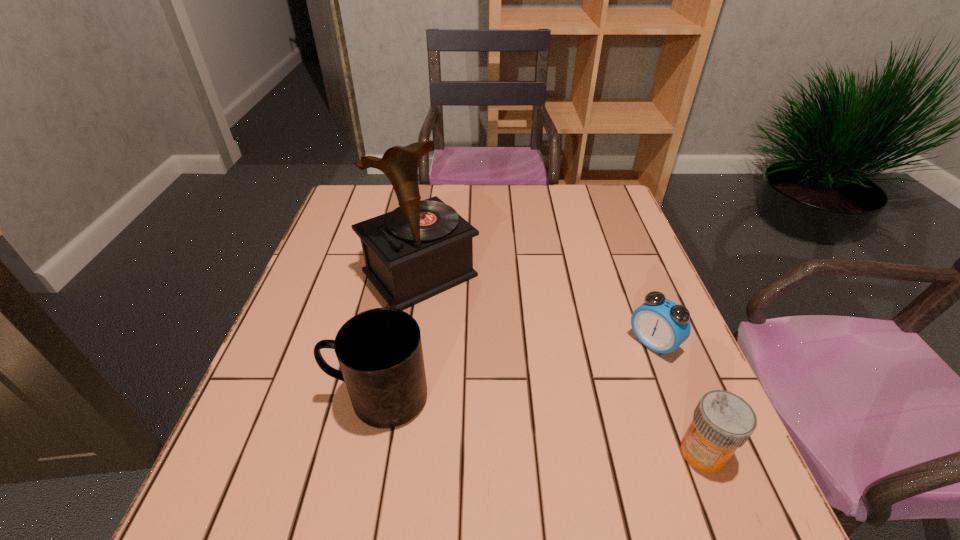
Find the location of a particular element. mug is located at coordinates tap(379, 351).

Locate an element on the screen. The width and height of the screenshot is (960, 540). medicine is located at coordinates (722, 421).

Locate an element on the screen. the second farthest object is located at coordinates (660, 324).

In order to click on phonograph_record in this screenshot , I will do `click(422, 248)`.

The width and height of the screenshot is (960, 540). What are the coordinates of `the tallest object` in the screenshot? It's located at (422, 248).

Identify the location of blank area located 0.140m on the side of the second tallest object with the handle. Image resolution: width=960 pixels, height=540 pixels. (258, 397).

The width and height of the screenshot is (960, 540). What are the coordinates of `vacant space positioned on the side of the second tallest object with the handle` in the screenshot? It's located at (253, 397).

This screenshot has width=960, height=540. I want to click on free space located 0.390m on the label side of the medicine, so pyautogui.click(x=457, y=453).

Locate an element on the screen. vacant space located on the label side of the medicine is located at coordinates click(451, 453).

Identify the location of free location located 0.090m on the label side of the medicine. (628, 453).